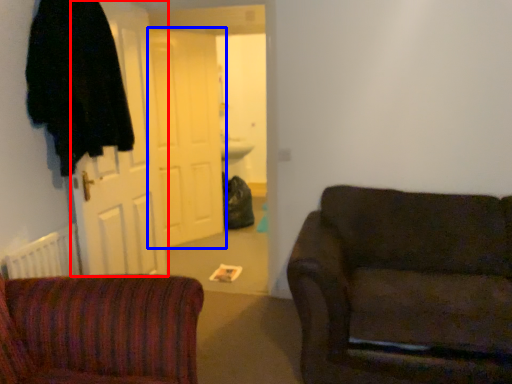
Question: Among these objects, which one is nearest to the camera, door (highlighted by a red box) or door (highlighted by a blue box)?

Choices:
 (A) door
 (B) door

Answer: (A)